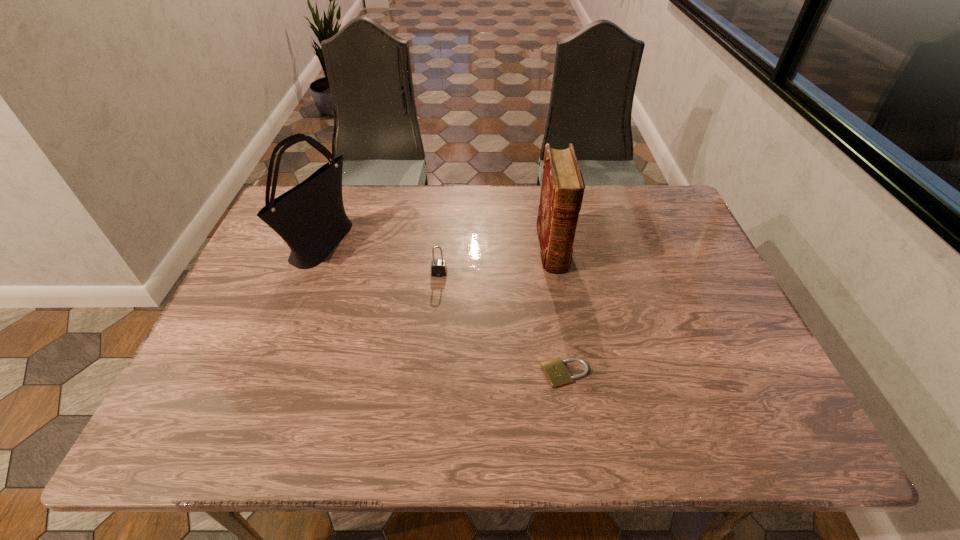
Where is `free space between the tallest object and the left padlock`? This screenshot has width=960, height=540. free space between the tallest object and the left padlock is located at coordinates (380, 259).

Where is `free space between the shorter padlock and the tallest object`? The height and width of the screenshot is (540, 960). free space between the shorter padlock and the tallest object is located at coordinates (444, 309).

You are a GUI agent. You are given a task and a screenshot of the screen. Output one action in this format:
    pyautogui.click(x=<x>, y=<y>)
    Task: Click on the vacant region between the hardback book and the taller padlock
    
    Given the screenshot: What is the action you would take?
    point(495,261)

Where is `vacant space that is in between the second shortest object and the leftmost object`? vacant space that is in between the second shortest object and the leftmost object is located at coordinates (380, 259).

This screenshot has width=960, height=540. What are the coordinates of `empty space that is in between the second object from left to right and the tallest object` in the screenshot? It's located at (380, 259).

You are a GUI agent. You are given a task and a screenshot of the screen. Output one action in this format:
    pyautogui.click(x=<x>, y=<y>)
    Task: Click on the free space between the third tallest object and the third shortest object
    
    Given the screenshot: What is the action you would take?
    pyautogui.click(x=495, y=261)

You are a GUI agent. You are given a task and a screenshot of the screen. Output one action in this format:
    pyautogui.click(x=<x>, y=<y>)
    Task: Click on the free spot between the hardback book and the nearer padlock
    The height and width of the screenshot is (540, 960).
    Given the screenshot: What is the action you would take?
    pyautogui.click(x=559, y=311)

You are a GUI agent. You are given a task and a screenshot of the screen. Output one action in this format:
    pyautogui.click(x=<x>, y=<y>)
    Task: Click on the vacant area that lies between the hardback book and the second object from left to right
    The width and height of the screenshot is (960, 540).
    Given the screenshot: What is the action you would take?
    pyautogui.click(x=495, y=261)

I want to click on object that stands as the second closest to the shorter padlock, so click(438, 267).

Find the location of a particular element. object that is the second closest one to the shorter padlock is located at coordinates [x=438, y=267].